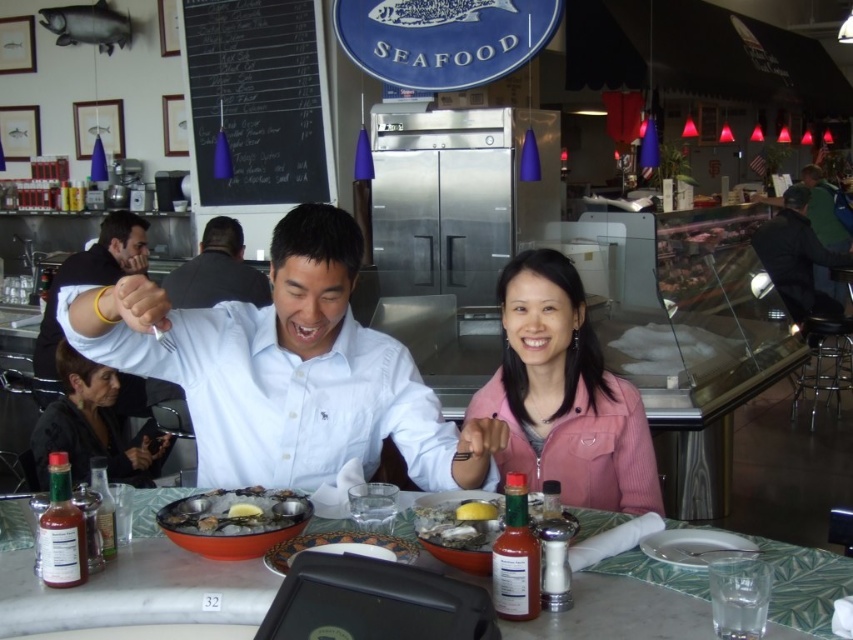
Question: Where is light blue shirt at center located in relation to green fabric jacket at upper right in the image?

Choices:
 (A) below
 (B) above

Answer: (A)

Question: Which of the following is the farthest from the observer?

Choices:
 (A) (241, 513)
 (B) (842, 291)

Answer: (B)

Question: Where is shiny silver oyster at center located in relation to green fabric jacket at upper right in the image?

Choices:
 (A) left
 (B) right

Answer: (A)

Question: Estimate the real-world distances between objects in this image. Which object is farther from the white shirt at center?

Choices:
 (A) light blue shirt at center
 (B) shiny silver oyster at center

Answer: (A)

Question: Among these points, which one is nearest to the camera?

Choices:
 (A) (467, 516)
 (B) (573, 476)
 (C) (189, 305)
 (D) (805, 257)

Answer: (A)

Question: Does shiny silver oysters at center appear over green fabric jacket at upper right?

Choices:
 (A) yes
 (B) no

Answer: (B)